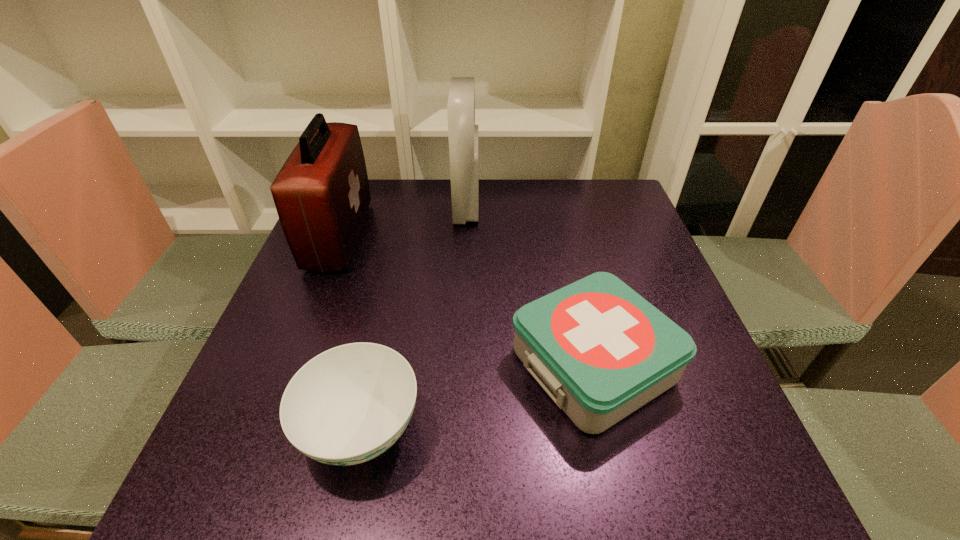
Where is `vacant space that is in between the chinaware and the second object from right to left`? The height and width of the screenshot is (540, 960). vacant space that is in between the chinaware and the second object from right to left is located at coordinates (414, 318).

Select which object is the third closest to the second first-aid kit from right to left. Please provide its 2D coordinates. Your answer should be formatted as a tuple, i.e. [(x, y)], where the tuple contains the x and y coordinates of a point satisfying the conditions above.

[(349, 404)]

Identify the location of object that is the second nearest to the chinaware. (321, 194).

Point out which first-aid kit is positioned as the nearest to the rightmost first-aid kit. Please provide its 2D coordinates. Your answer should be formatted as a tuple, i.e. [(x, y)], where the tuple contains the x and y coordinates of a point satisfying the conditions above.

[(462, 132)]

Identify which first-aid kit is the nearest to the rightmost object. Please provide its 2D coordinates. Your answer should be formatted as a tuple, i.e. [(x, y)], where the tuple contains the x and y coordinates of a point satisfying the conditions above.

[(462, 132)]

I want to click on free location that satisfies the following two spatial constraints: 1. on the front-facing side of the rightmost object; 2. on the right side of the third object from left to right, so pos(460,364).

Image resolution: width=960 pixels, height=540 pixels. I want to click on free spot that satisfies the following two spatial constraints: 1. on the side of the chinaware with the cross symbol; 2. on the left side of the leftmost first-aid kit, so click(x=263, y=430).

Identify the location of blank area in the image that satisfies the following two spatial constraints: 1. on the front-facing side of the second first-aid kit from right to left; 2. on the back side of the rightmost object. (460, 364).

At what (x,y) coordinates should I click in order to perform the action: click on blank space that satisfies the following two spatial constraints: 1. on the back side of the shortest first-aid kit; 2. on the front-facing side of the second first-aid kit from right to left. Please return your answer as a coordinate pair (x, y). Looking at the image, I should click on (556, 207).

You are a GUI agent. You are given a task and a screenshot of the screen. Output one action in this format:
    pyautogui.click(x=<x>, y=<y>)
    Task: Click on the vacant space that satisfies the following two spatial constraints: 1. on the front-facing side of the rightmost object; 2. on the right side of the second object from right to left
    The width and height of the screenshot is (960, 540).
    Given the screenshot: What is the action you would take?
    (460, 364)